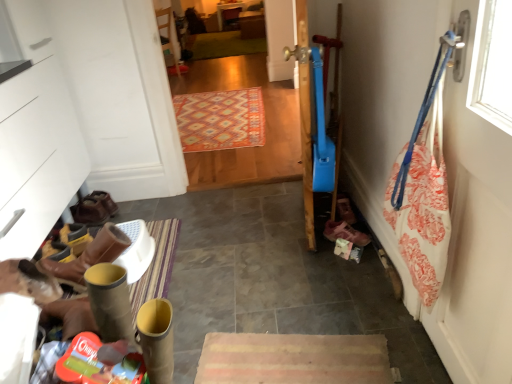
The height and width of the screenshot is (384, 512). I want to click on vacant area located to the right-hand side of brown leather boots at lower left, positioned as the second footwear in right-to-left order, so click(x=129, y=208).